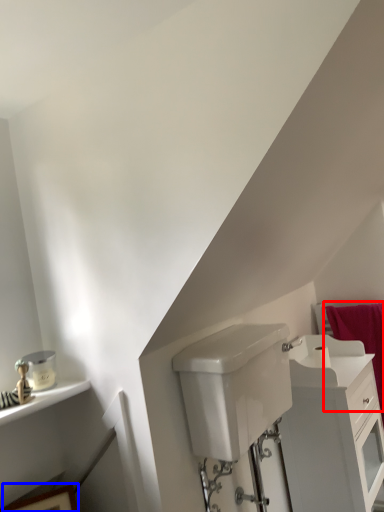
Question: Which point is closer to the camera, bath towel (highlighted by a red box) or picture frame (highlighted by a blue box)?

Choices:
 (A) bath towel
 (B) picture frame

Answer: (B)